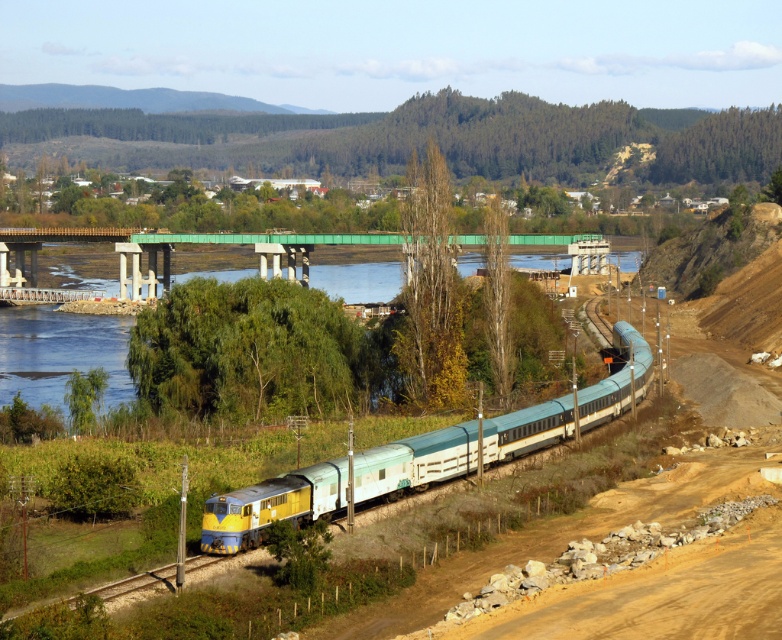
Based on the photo, can you confirm if yellow and blue painted train at center is positioned above green concrete bridge at center?

No, yellow and blue painted train at center is not above green concrete bridge at center.

At what (x,y) coordinates should I click in order to perform the action: click on yellow and blue painted train at center. Please return your answer as a coordinate pair (x, y). Looking at the image, I should click on (501, 429).

Does point (285, 476) lie in front of point (146, 244)?

Yes, it is in front of point (146, 244).

The image size is (782, 640). I want to click on yellow and blue painted train at center, so click(501, 429).

Can you confirm if yellow and blue painted train at center is positioned above yellow metallic train track at lower left?

Yes, yellow and blue painted train at center is above yellow metallic train track at lower left.

Which is in front, point (242, 522) or point (210, 563)?

Point (210, 563) is in front.

Which is behind, point (256, 484) or point (117, 598)?

Positioned behind is point (256, 484).

At what (x,y) coordinates should I click in order to perform the action: click on yellow and blue painted train at center. Please return your answer as a coordinate pair (x, y). The image size is (782, 640). Looking at the image, I should click on (501, 429).

Who is positioned more to the right, green concrete bridge at center or yellow metallic train track at lower left?

From the viewer's perspective, green concrete bridge at center appears more on the right side.

Is green concrete bridge at center wider than yellow metallic train track at lower left?

Yes.

Is point (231, 237) positioned before point (137, 582)?

No.

Locate an element on the screen. green concrete bridge at center is located at coordinates (187, 243).